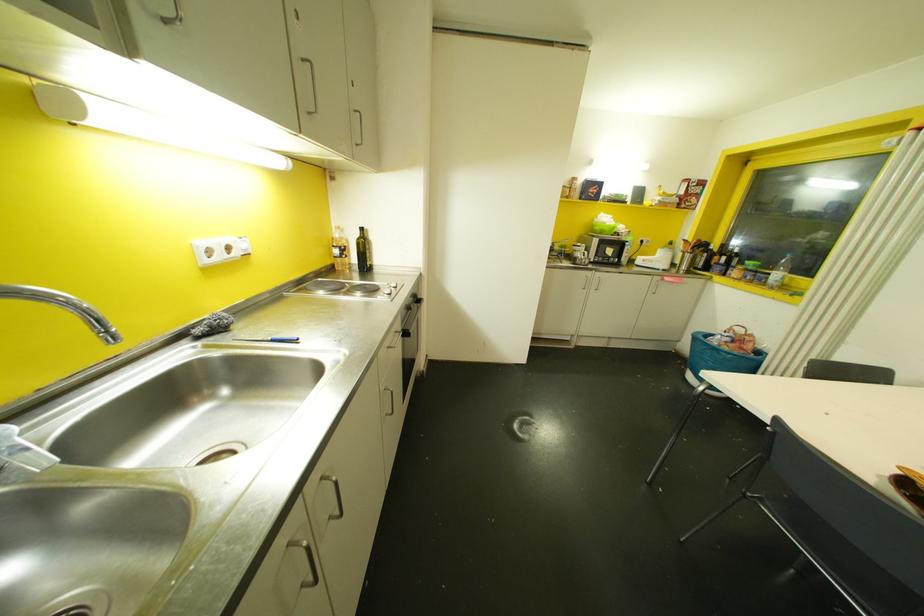
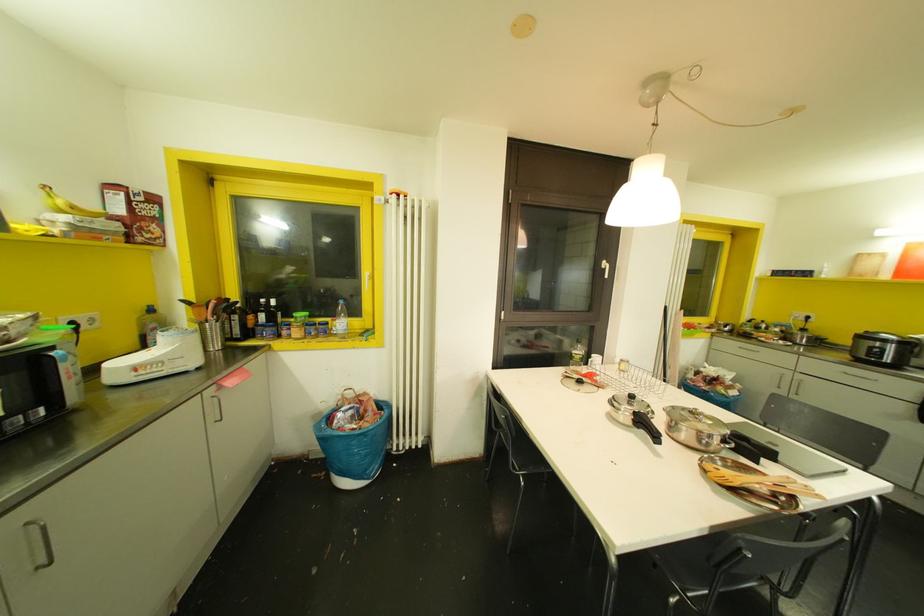
Where in the second image is the point corresponding to (638,262) from the first image?

(116, 378)